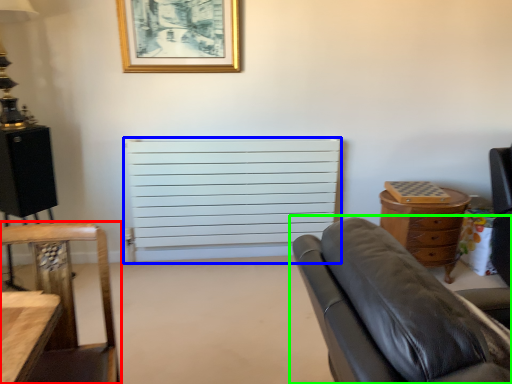
Question: Which object is the farthest from chair (highlighted by a red box)? Choose among these: radiator (highlighted by a blue box) or studio couch (highlighted by a green box).

Choices:
 (A) radiator
 (B) studio couch

Answer: (A)